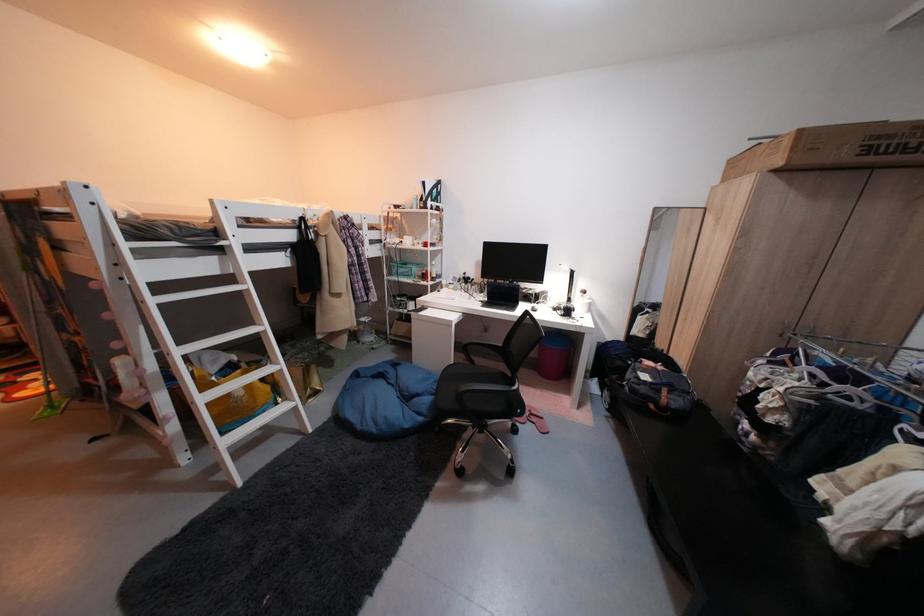
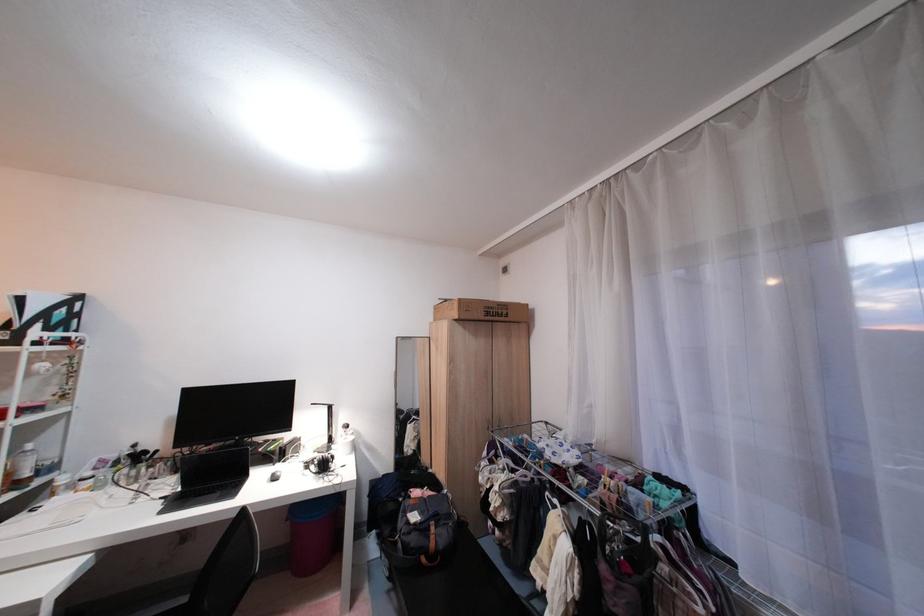
Locate, in the second image, the point that corresponds to the point at 444,265 in the first image.

(35, 453)